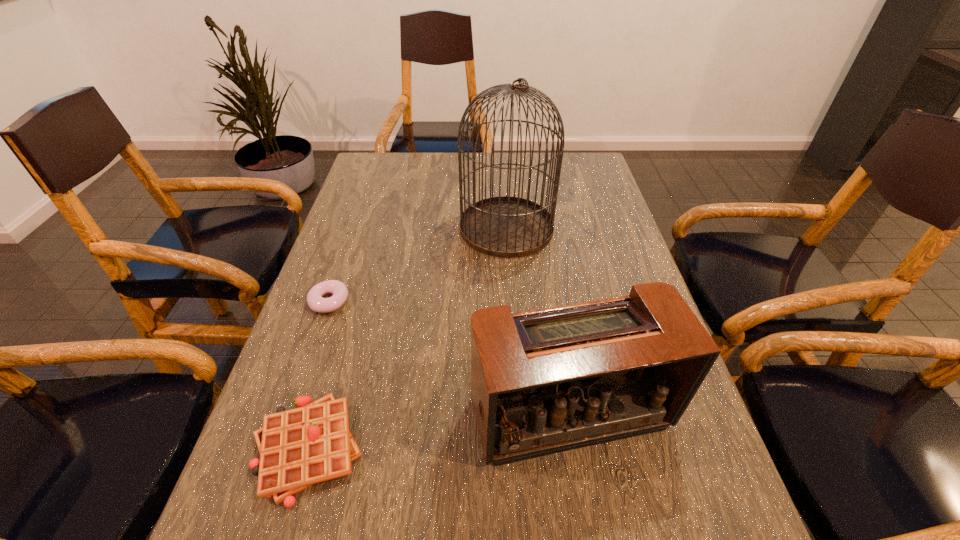
Where is `birdcage`? This screenshot has width=960, height=540. birdcage is located at coordinates (508, 227).

Where is `the tallest object`? This screenshot has height=540, width=960. the tallest object is located at coordinates (508, 227).

Locate an element on the screen. The image size is (960, 540). radio receiver is located at coordinates (546, 381).

Image resolution: width=960 pixels, height=540 pixels. Identify the location of waffle. (299, 447).

At what (x,y) coordinates should I click in order to perform the action: click on the second farthest object. Please return your answer as a coordinate pair (x, y). Looking at the image, I should click on (316, 302).

You are a GUI agent. You are given a task and a screenshot of the screen. Output one action in this format:
    pyautogui.click(x=<x>, y=<y>)
    Task: Click on the shortest object
    
    Given the screenshot: What is the action you would take?
    pyautogui.click(x=316, y=302)

Find the location of a particular element. Image resolution: width=960 pixels, height=540 pixels. free location located on the back of the birdcage is located at coordinates (504, 191).

You are a GUI agent. You are given a task and a screenshot of the screen. Output one action in this format:
    pyautogui.click(x=<x>, y=<y>)
    Task: Click on the vacant region located on the left of the radio receiver
    The height and width of the screenshot is (540, 960).
    Given the screenshot: What is the action you would take?
    coord(439,413)

At what (x,y) coordinates should I click in order to perform the action: click on vacant area situated 0.160m on the right of the waffle. Please return your answer as a coordinate pair (x, y). Looking at the image, I should click on (457, 448).

At what (x,y) coordinates should I click in order to perform the action: click on vacant space located 0.190m on the right of the shortest object. Please return your answer as a coordinate pair (x, y). Image resolution: width=960 pixels, height=540 pixels. Looking at the image, I should click on (431, 302).